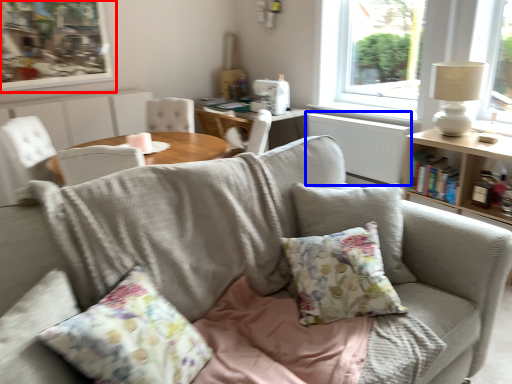
Question: Which point is closer to the camera, picture frame (highlighted by a red box) or radiator (highlighted by a blue box)?

Choices:
 (A) picture frame
 (B) radiator

Answer: (B)